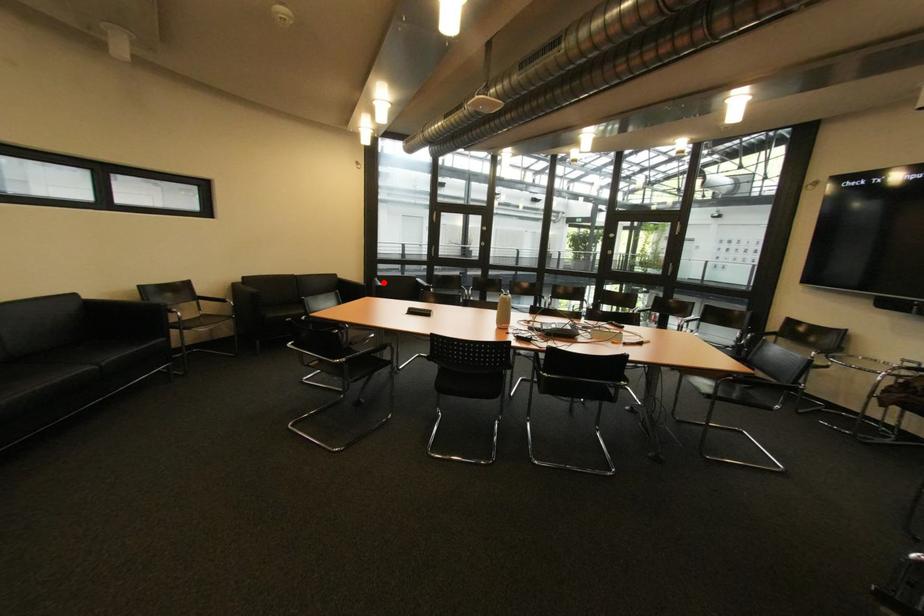
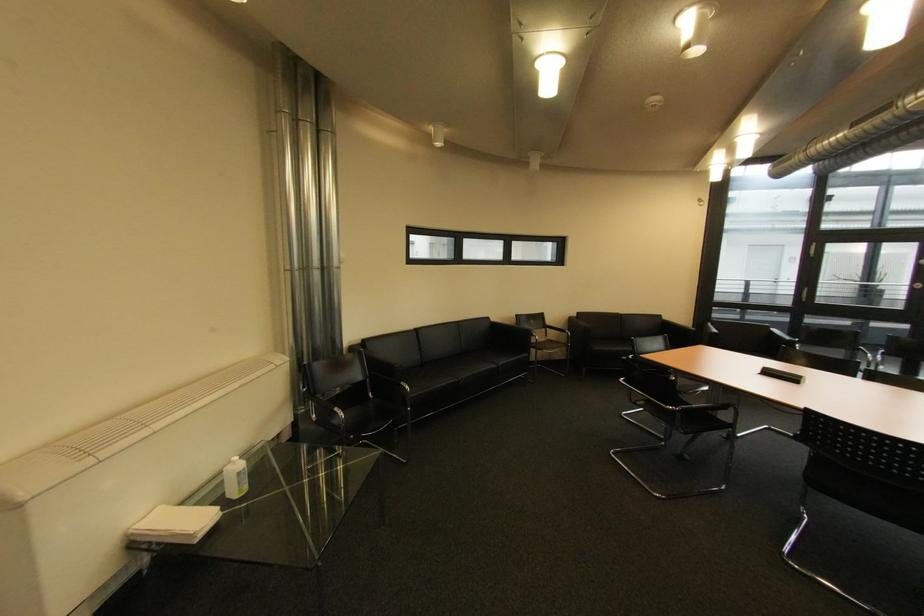
The point at the highlighted location is marked in the first image. Where is the corresponding point in the second image?

(716, 329)